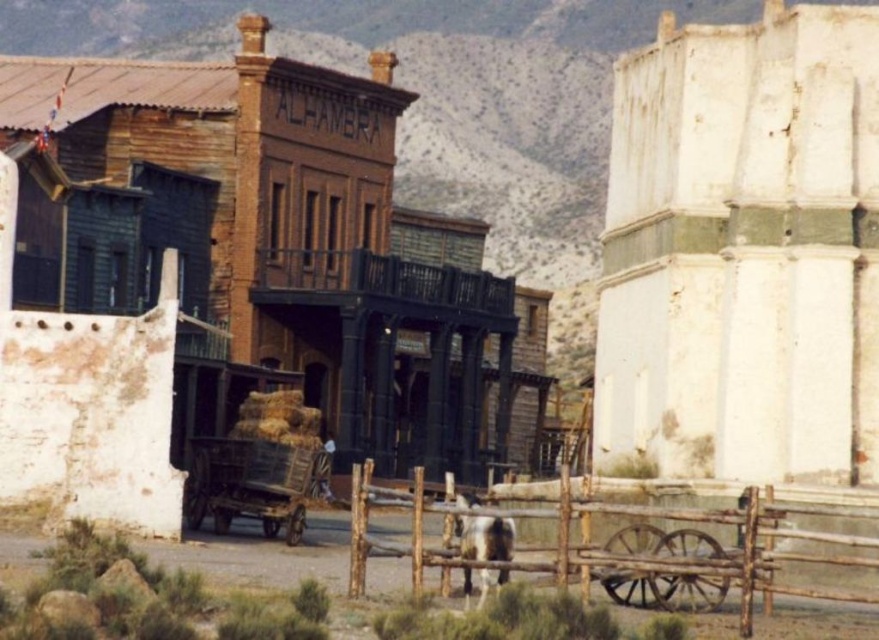
You are an actor in a Western movie set and need to quickly hide behind an object when the scene requires it. Given the rustic wooden building at center and the brown wooden fence at lower center, which one would provide better cover from an attacker approaching from the front?

The rustic wooden building at center is much taller than the brown wooden fence at lower center, so it would provide better cover from an attacker approaching from the front.

From the picture: You are a stagehand setting up a movie scene in the Western town. You need to place a new prop, a wooden cart at center, next to the rustic wooden building at center. Based on their sizes, which one should be placed first to ensure proper spacing?

The rustic wooden building at center is wider than the wooden cart at center. Therefore, you should place the rustic wooden building at center first to ensure there is enough space for the wooden cart at center next to it.

You are a stunt coordinator planning a chase scene in this Western town. You need to know if a horse can gallop from the brown wooden fence at lower center to the rustic wooden building at center without slowing down. The horse can maintain a gallop for 20 meters. Can it make it?

The distance between the brown wooden fence at lower center and the rustic wooden building at center is 21.74 meters. Since the horse can gallop for 20 meters, it cannot maintain speed the entire distance and will need to slow down before reaching the rustic wooden building at center.